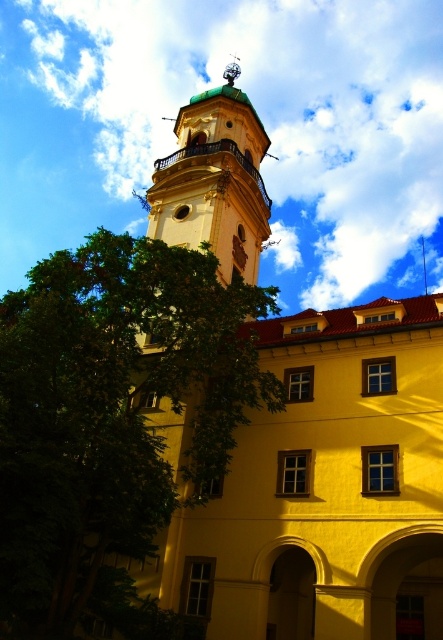
Question: In this image, where is green leafy tree at left located relative to matte yellow bell tower at center?

Choices:
 (A) right
 (B) left

Answer: (B)

Question: Which point is farther from the camera taking this photo?

Choices:
 (A) (162, 376)
 (B) (205, 99)

Answer: (B)

Question: Can you confirm if green leafy tree at left is positioned to the left of matte yellow bell tower at center?

Choices:
 (A) yes
 (B) no

Answer: (A)

Question: Among these objects, which one is nearest to the camera?

Choices:
 (A) matte yellow bell tower at center
 (B) green leafy tree at left

Answer: (B)

Question: Does green leafy tree at left have a larger size compared to matte yellow bell tower at center?

Choices:
 (A) no
 (B) yes

Answer: (B)